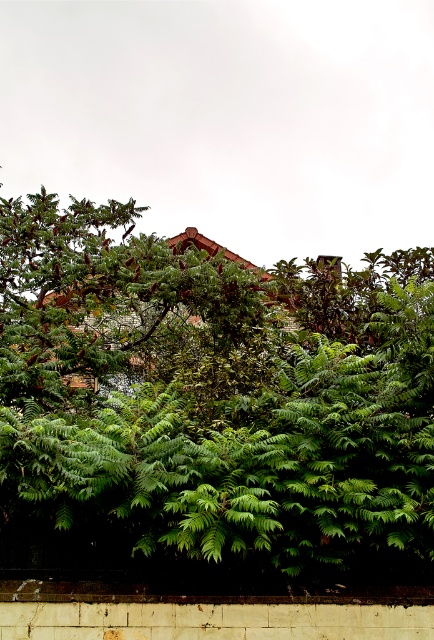
This screenshot has height=640, width=434. What do you see at coordinates (210, 401) in the screenshot? I see `green leafy tree at center` at bounding box center [210, 401].

Does point (209, 260) come in front of point (378, 595)?

No.

Which is in front, point (161, 284) or point (249, 586)?

Positioned in front is point (249, 586).

Where is `green leafy tree at center`? The height and width of the screenshot is (640, 434). green leafy tree at center is located at coordinates (210, 401).